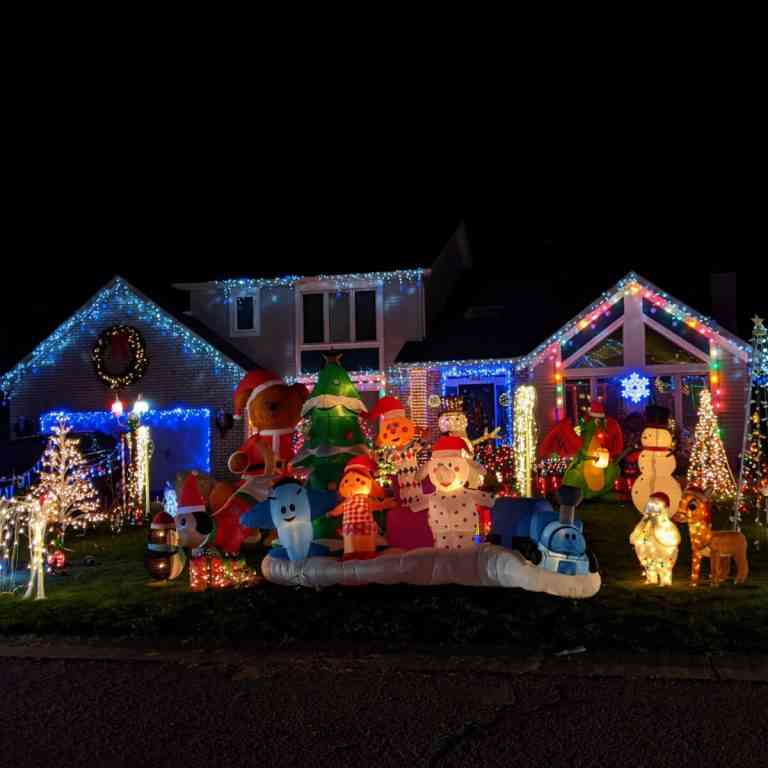
Find the location of `window`. window is located at coordinates (611, 348).